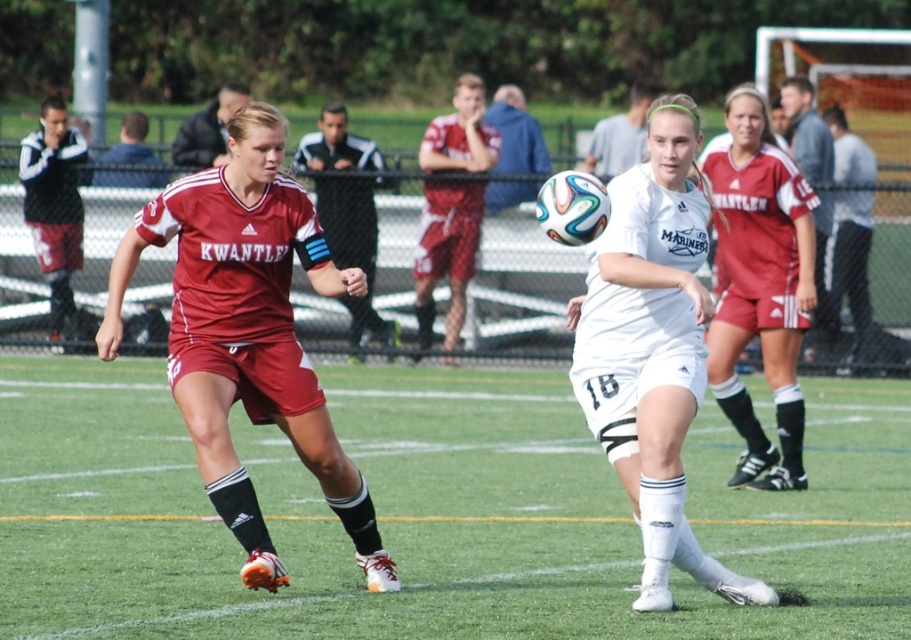
Question: Which point is closer to the camera?

Choices:
 (A) matte red shorts at center
 (B) white matte soccer ball at center

Answer: (B)

Question: Which object is positioned farthest from the matte red shorts at center?

Choices:
 (A) green grass at center
 (B) white matte soccer ball at center

Answer: (B)

Question: Can you confirm if green grass at center is thinner than matte red shorts at center?

Choices:
 (A) yes
 (B) no

Answer: (B)

Question: Considering the real-world distances, which object is closest to the matte red shorts at center?

Choices:
 (A) white matte soccer ball at center
 (B) green grass at center

Answer: (B)

Question: Observing the image, what is the correct spatial positioning of green grass at center in reference to white matte soccer ball at center?

Choices:
 (A) right
 (B) left

Answer: (B)

Question: Is green grass at center above matte red shorts at center?

Choices:
 (A) yes
 (B) no

Answer: (B)